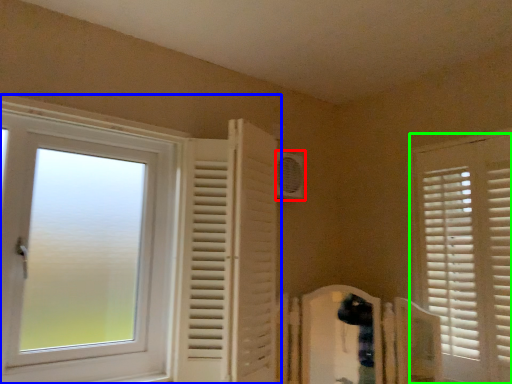
Question: Which object is positioned farthest from air conditioning (highlighted by a red box)? Select from window (highlighted by a blue box) and window (highlighted by a green box).

Choices:
 (A) window
 (B) window

Answer: (B)